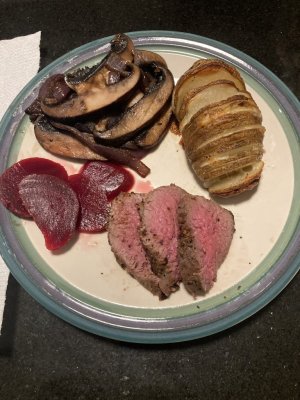
You are a GUI agent. You are given a task and a screenshot of the screen. Output one action in this format:
    pyautogui.click(x=<x>, y=<y>)
    Task: Click on the surface on which the plate sets
    
    Given the screenshot: What is the action you would take?
    pyautogui.click(x=151, y=364)